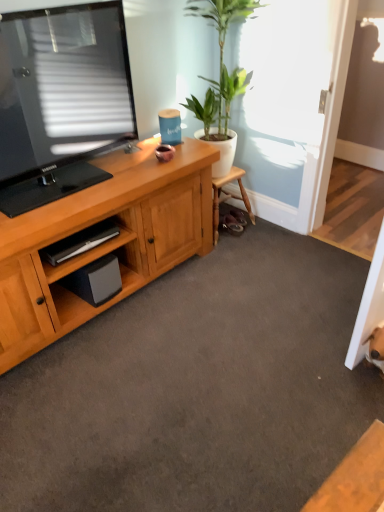
Question: In the image, is black matte speaker at lower left positioned in front of or behind green glossy plant at upper center?

Choices:
 (A) behind
 (B) front

Answer: (A)

Question: Is black matte speaker at lower left taller or shorter than green glossy plant at upper center?

Choices:
 (A) short
 (B) tall

Answer: (A)

Question: Which of these objects is positioned farthest from the black matte speaker at lower left?

Choices:
 (A) green glossy plant at upper center
 (B) wooden cabinet at lower left

Answer: (A)

Question: Which object is positioned closest to the wooden cabinet at lower left?

Choices:
 (A) green glossy plant at upper center
 (B) black matte speaker at lower left

Answer: (B)